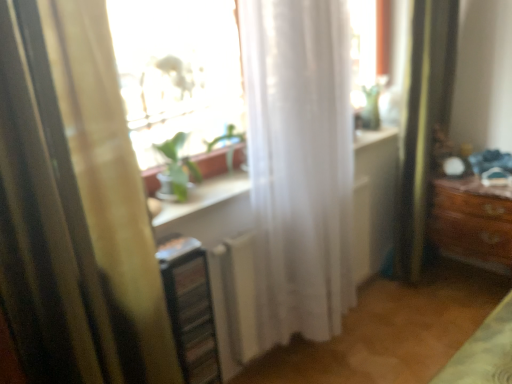
Question: Is metallic silver shelf at lower left taller or shorter than yellow striped curtain at left, placed as the 2th curtain when sorted from right to left?

Choices:
 (A) short
 (B) tall

Answer: (A)

Question: Is metallic silver shelf at lower left spatially inside yellow striped curtain at left, placed as the 2th curtain when sorted from right to left, or outside of it?

Choices:
 (A) outside
 (B) inside

Answer: (A)

Question: Which object is the closest to the yellow striped curtain at left, placed as the 2th curtain when sorted from right to left?

Choices:
 (A) metallic silver shelf at lower left
 (B) green fabric shower curtain at right
 (C) transparent glass window at center
 (D) white sheer curtain at center, placed as the second curtain when sorted from left to right

Answer: (A)

Question: Which is farther from the white sheer curtain at center, placed as the second curtain when sorted from left to right?

Choices:
 (A) green fabric shower curtain at right
 (B) metallic silver shelf at lower left
 (C) transparent glass window at center
 (D) yellow striped curtain at left, the 1th curtain positioned from the left

Answer: (A)